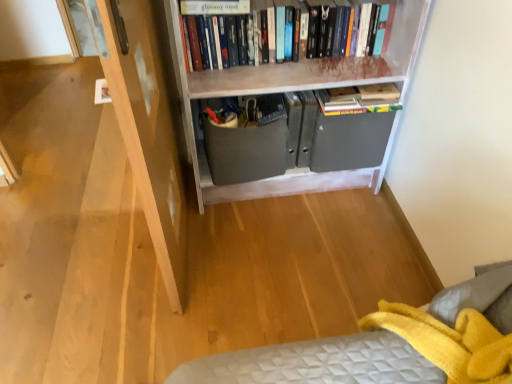
At what (x,y) coordinates should I click in order to perform the action: click on empty space that is ontop of matte gray drawer at center (from a real-world perspective). Please return your answer as a coordinate pair (x, y). Looking at the image, I should click on (245, 111).